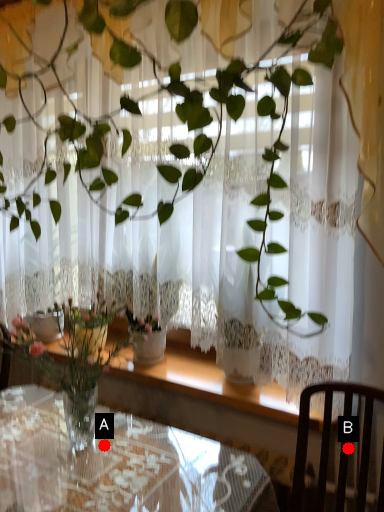
Question: Two points are circled on the image, labeled by A and B beside each circle. Among these points, which one is nearest to the camera?

Choices:
 (A) A is closer
 (B) B is closer

Answer: (B)